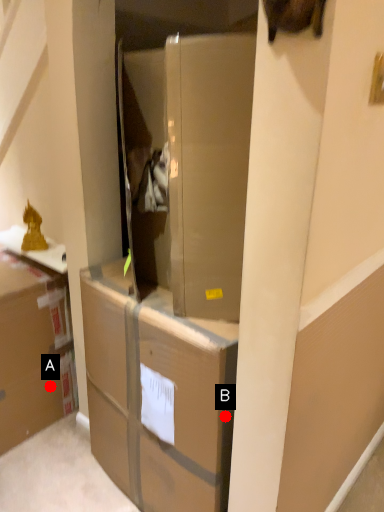
Question: Two points are circled on the image, labeled by A and B beside each circle. Which point is further to the camera?

Choices:
 (A) A is further
 (B) B is further

Answer: (A)